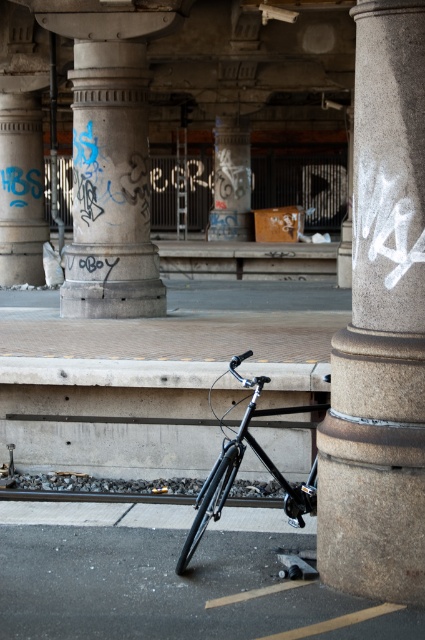
In the scene shown: You are an urban explorer standing in the middle of the bridge. You see the granite column at center and the concrete textured pillar at center. Which one is positioned lower in the scene?

The granite column at center is located below the concrete textured pillar at center, so it is positioned lower in the scene.

You are a delivery person who needs to park your shiny black bicycle at center on the black asphalt at lower center. Is the asphalt wide enough to park the bicycle without it overlapping the pillar or the graffiti?

The black asphalt at lower center is positioned under the shiny black bicycle at center, so yes, the bicycle can be parked there without overlapping the pillar or graffiti as it is already centered on the asphalt.

You are an urban planner assessing the structural integrity of the bridge. You notice the granite column at center and the concrete textured pillar at center. Which one might require more reinforcement due to its size?

The concrete textured pillar at center requires more reinforcement because it is larger than the granite column at center.